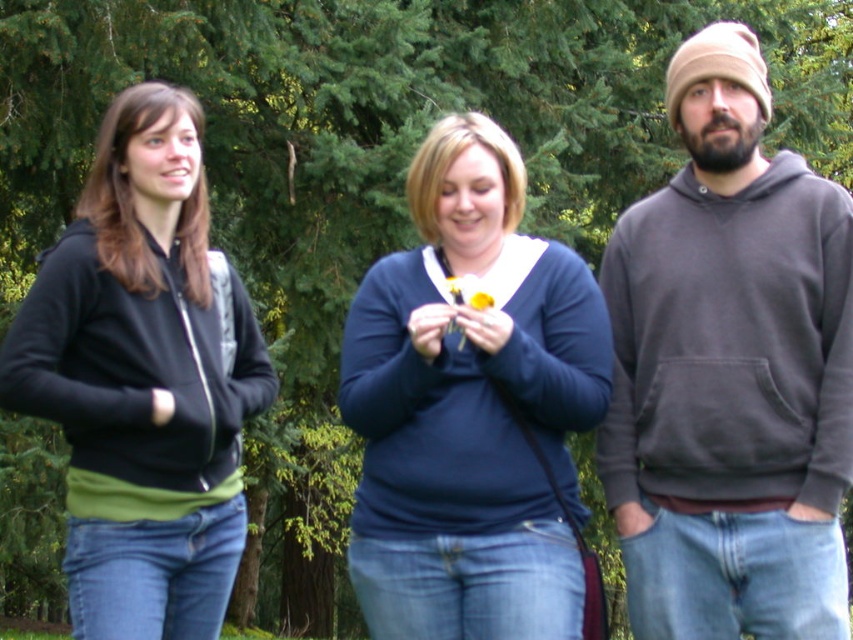
Between blue matte sweater at center and black matte hoodie at left, which one is positioned lower?

blue matte sweater at center is lower down.

Identify the location of blue matte sweater at center. (471, 408).

Between gray hoodie at right and yellow matte flower at center, which one has more height?

gray hoodie at right

Consider the image. Between gray hoodie at right and yellow matte flower at center, which one appears on the left side from the viewer's perspective?

From the viewer's perspective, yellow matte flower at center appears more on the left side.

Find the location of a particular element. Image resolution: width=853 pixels, height=640 pixels. gray hoodie at right is located at coordinates pyautogui.click(x=730, y=371).

Locate an element on the screen. gray hoodie at right is located at coordinates (730, 371).

You are a GUI agent. You are given a task and a screenshot of the screen. Output one action in this format:
    pyautogui.click(x=<x>, y=<y>)
    Task: Click on the gray hoodie at right
    The width and height of the screenshot is (853, 640).
    Given the screenshot: What is the action you would take?
    pyautogui.click(x=730, y=371)

Is gray hoodie at right shorter than blue matte sweater at center?

Incorrect, gray hoodie at right's height does not fall short of blue matte sweater at center's.

Between point (724, 221) and point (517, 307), which one is positioned in front?

Point (517, 307) is more forward.

Identify the location of gray hoodie at right. (730, 371).